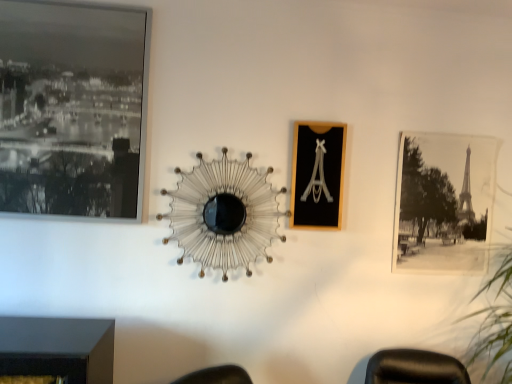
Question: Considering the positions of point (258, 251) and point (64, 84), is point (258, 251) closer or farther from the camera than point (64, 84)?

Choices:
 (A) closer
 (B) farther

Answer: (B)

Question: Is metallic wire at center taller or shorter than black glass picture frame at upper left, the 3th picture frame positioned from the right?

Choices:
 (A) tall
 (B) short

Answer: (B)

Question: Which object is the farthest from the black glass picture frame at upper left, the 3th picture frame positioned from the right?

Choices:
 (A) metallic wire at center
 (B) black wood picture frame at center, the 2th picture frame from the front
 (C) black paper photo at right, which appears as the 3th picture frame when viewed from the left
 (D) green leafy plant at right

Answer: (D)

Question: Based on their relative distances, which object is nearer to the green leafy plant at right?

Choices:
 (A) black glass picture frame at upper left, positioned as the 3th picture frame in back-to-front order
 (B) black wood picture frame at center, the 2th picture frame from the front
 (C) metallic wire at center
 (D) black paper photo at right, marked as the third picture frame in a front-to-back arrangement

Answer: (D)